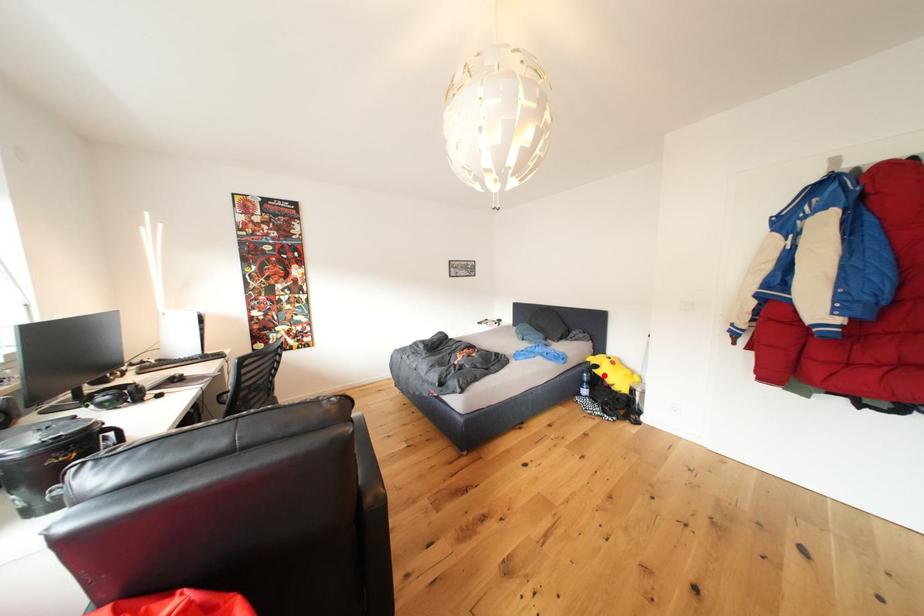
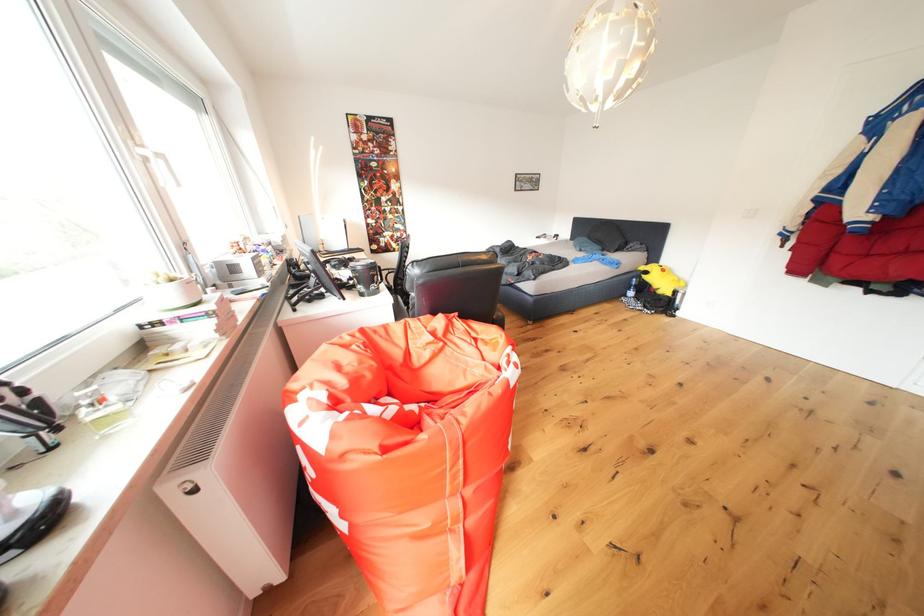
The point at the highlighted location is marked in the first image. Where is the corresponding point in the second image?

(653, 282)